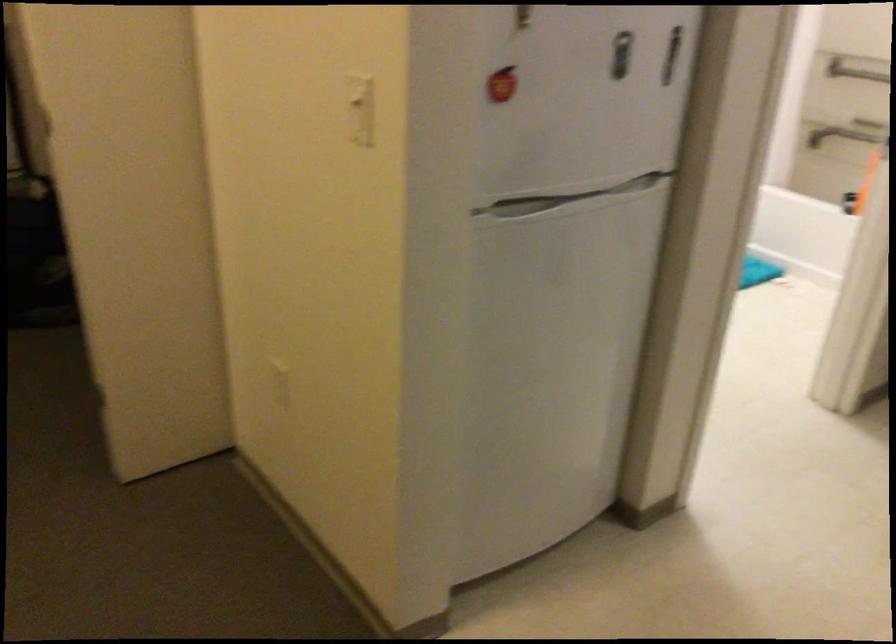
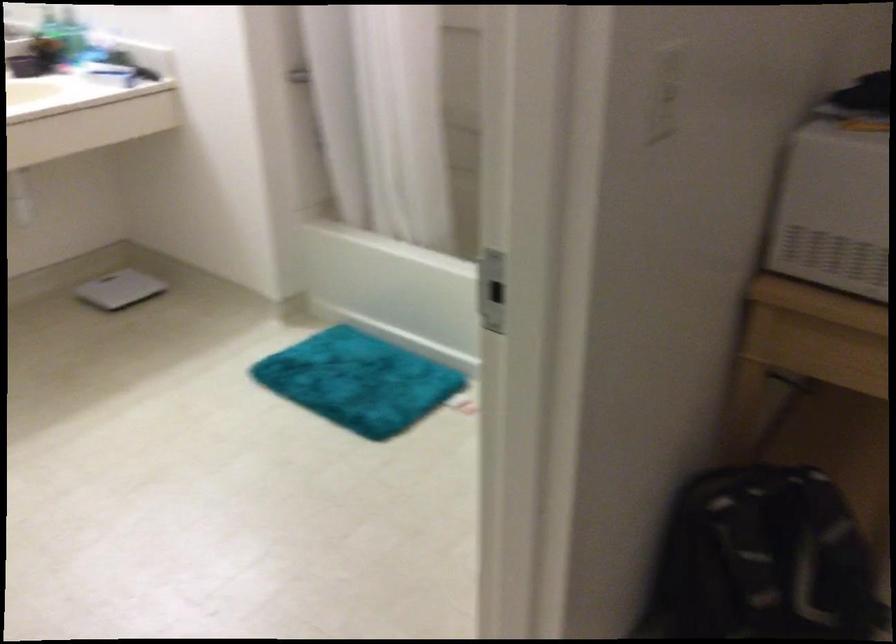
What movement of the cameraman would produce the second image?

The movement direction of the cameraman is right, forward.